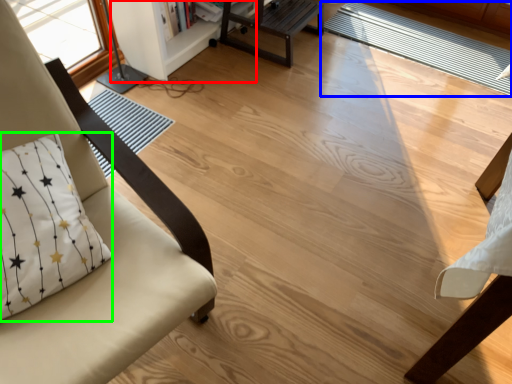
Question: Which is nearer to the bookshelf (highlighted by a red box)? mat (highlighted by a blue box) or pillow (highlighted by a green box).

Choices:
 (A) mat
 (B) pillow

Answer: (A)